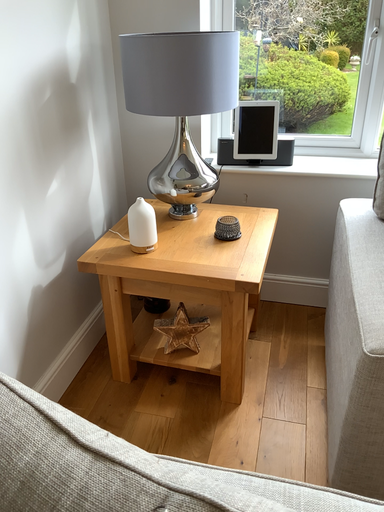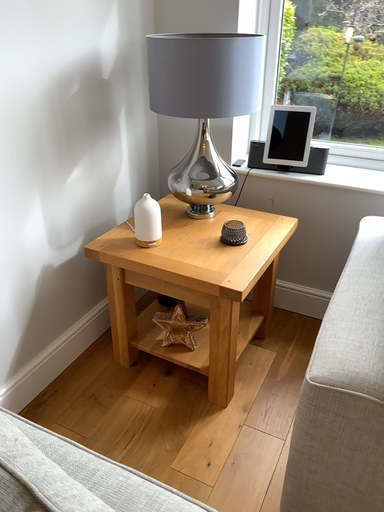
Question: How did the camera likely rotate when shooting the video?

Choices:
 (A) rotated left
 (B) rotated right

Answer: (A)